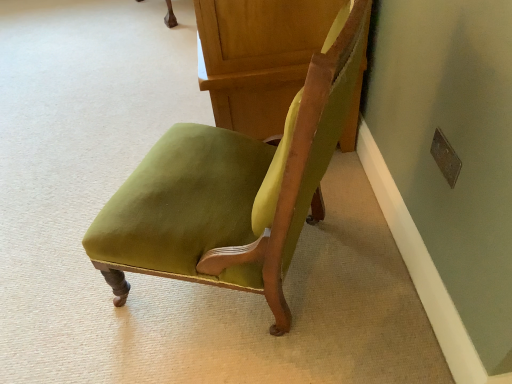
Image resolution: width=512 pixels, height=384 pixels. Identify the location of blank space to the left of velvet green chair at center. (69, 271).